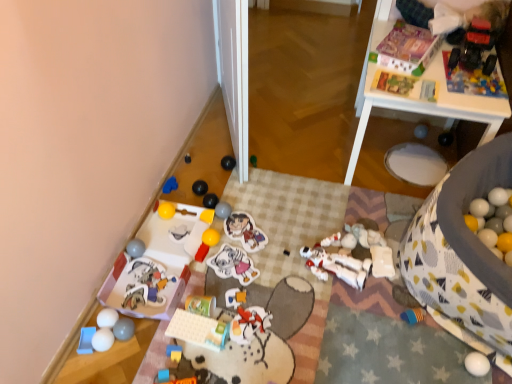
The image size is (512, 384). What are the coordinates of `spots to the right of matte plastic toy at lower left, the 5th toy in the left-to-right sequence` in the screenshot? It's located at (194, 282).